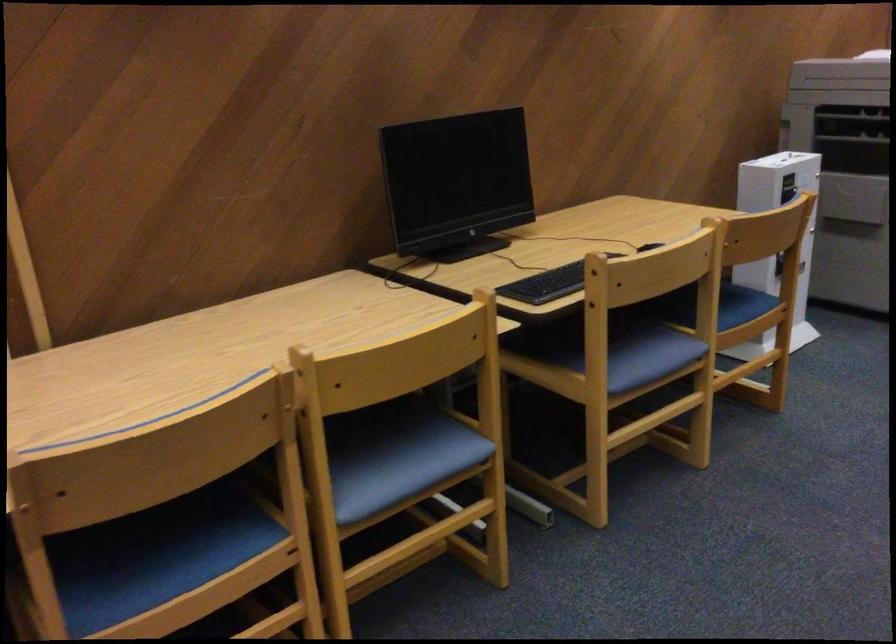
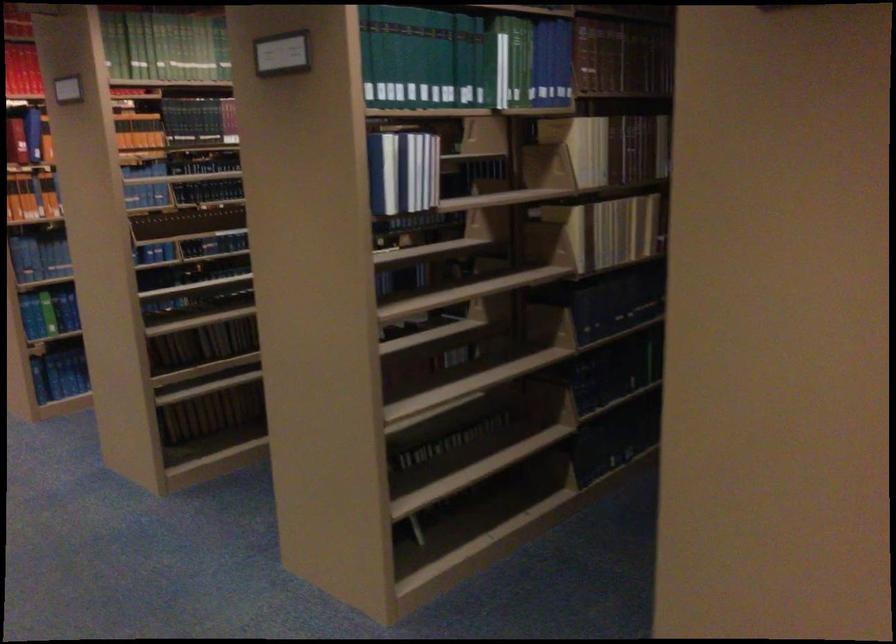
Question: The camera is either moving clockwise (left) or counter-clockwise (right) around the object. The first image is from the beginning of the video and the second image is from the end. Is the camera moving left or right when shooting the video?

Choices:
 (A) Left
 (B) Right

Answer: (A)